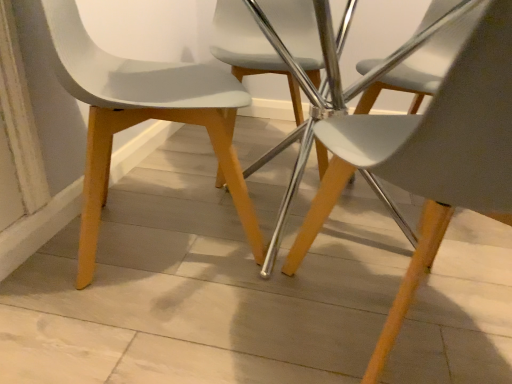
You are a GUI agent. You are given a task and a screenshot of the screen. Output one action in this format:
    pyautogui.click(x=<x>, y=<y>)
    Task: Click on the vacant area situated below matte white chair at left, arranged as the second chair when viewed from the front (from a real-world perspective)
    The image size is (512, 384).
    Given the screenshot: What is the action you would take?
    pyautogui.click(x=135, y=230)